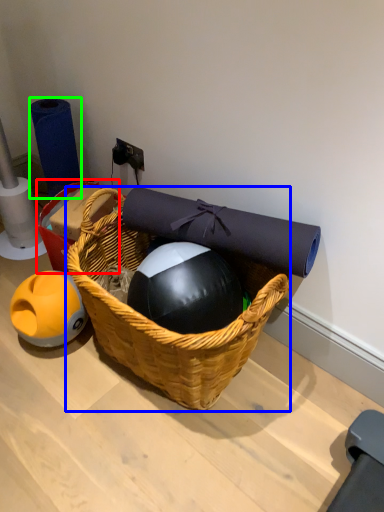
Question: Estimate the real-world distances between objects in this image. Which object is farther from basket (highlighted by a red box), picnic basket (highlighted by a blue box) or toilet paper (highlighted by a green box)?

Choices:
 (A) picnic basket
 (B) toilet paper

Answer: (A)